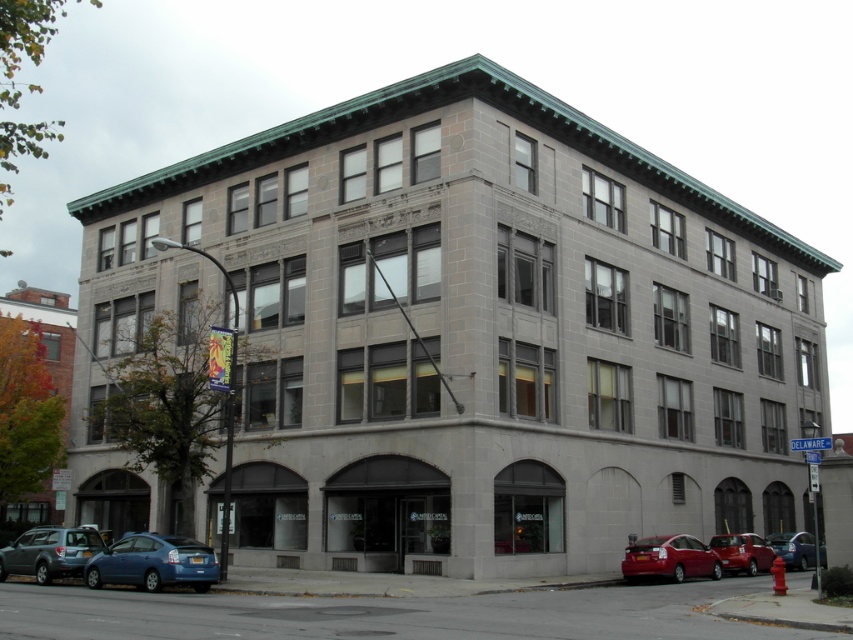
Based on the photo, you are a delivery person needing to park your van between the blue matte car at lower left and the shiny red sedan at lower right. Your van is 6 meters long. Is there enough space between them to park your van?

The blue matte car at lower left and shiny red sedan at lower right are 14.00 meters apart from each other. Since your van is 6 meters long, there is sufficient space between them to park your van.

You are standing on the sidewalk in front of the building and see both the shiny red sedan at lower right and the shiny red car at lower right. Which one is closer to you?

The shiny red sedan at lower right is closer to you than the shiny red car at lower right.